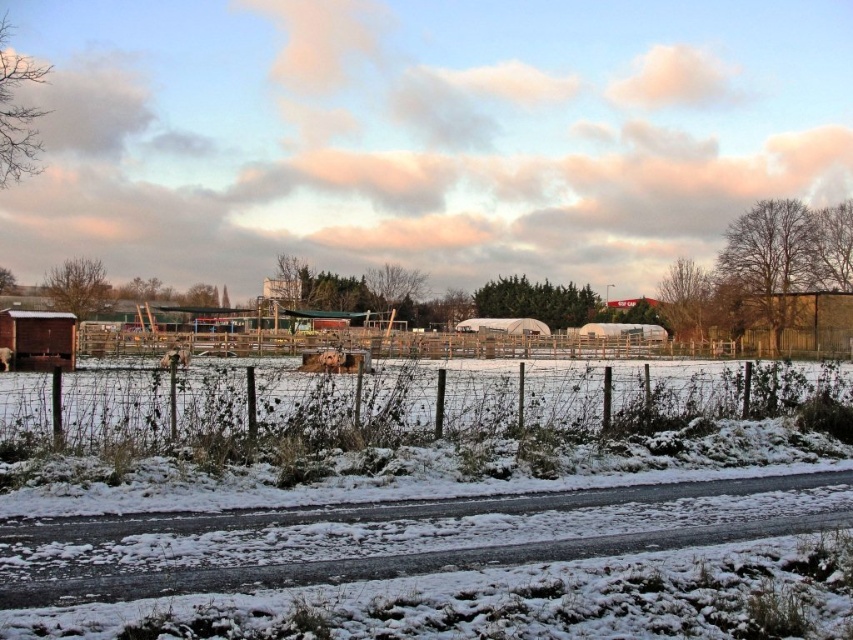
Which is more to the right, snow-covered grass at center or wooden fence at right?

Positioned to the right is wooden fence at right.

Where is `snow-covered grass at center`? This screenshot has width=853, height=640. snow-covered grass at center is located at coordinates (115, 408).

Does snow-covered grass at center have a smaller size compared to wooden fence at center?

Correct, snow-covered grass at center occupies less space than wooden fence at center.

Does point (668, 403) lie behind point (664, 344)?

No, (668, 403) is in front of (664, 344).

Locate an element on the screen. snow-covered grass at center is located at coordinates (115, 408).

From the picture: Who is positioned more to the right, wooden fence at center or wooden fence at right?

wooden fence at right is more to the right.

Identify the location of wooden fence at center. (537, 346).